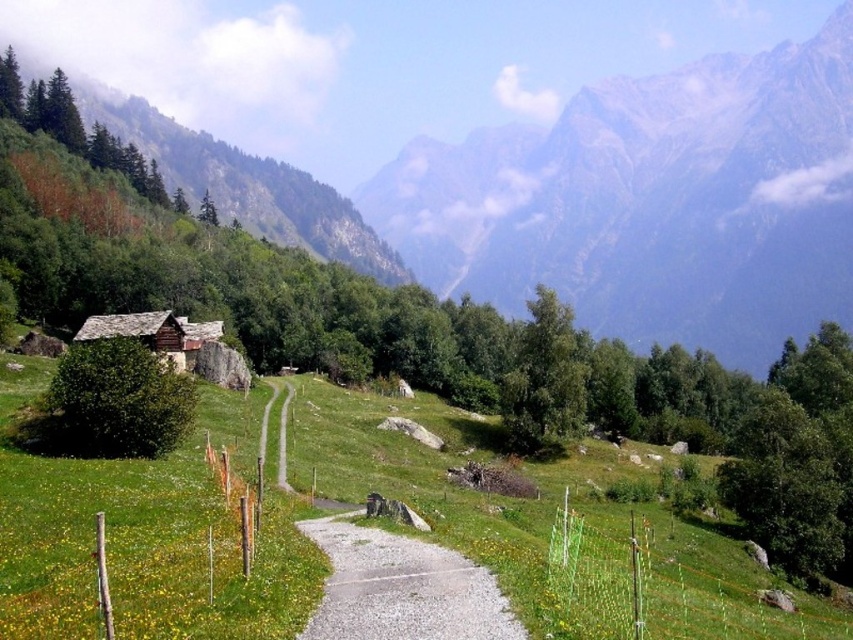
Describe the element at coordinates (653, 202) in the screenshot. I see `gray rocky mountain at upper center` at that location.

Is gray rocky mountain at upper center shorter than green grassy at lower left?

In fact, gray rocky mountain at upper center may be taller than green grassy at lower left.

Does point (544, 225) come behind point (554, 467)?

Yes, it is.

The height and width of the screenshot is (640, 853). I want to click on gray rocky mountain at upper center, so click(653, 202).

Between point (340, 540) and point (178, 371), which one is positioned in front?

Point (340, 540)

Is point (280, 433) behind point (149, 349)?

No, (280, 433) is in front of (149, 349).

Image resolution: width=853 pixels, height=640 pixels. In order to click on gravelly dirt path at center in this screenshot , I will do `click(399, 586)`.

Can you confirm if green grassy at lower left is positioned to the left of rustic stone hut at lower left?

Incorrect, green grassy at lower left is not on the left side of rustic stone hut at lower left.

I want to click on green grassy at lower left, so click(x=143, y=536).

Find the location of a particular element. green grassy at lower left is located at coordinates (143, 536).